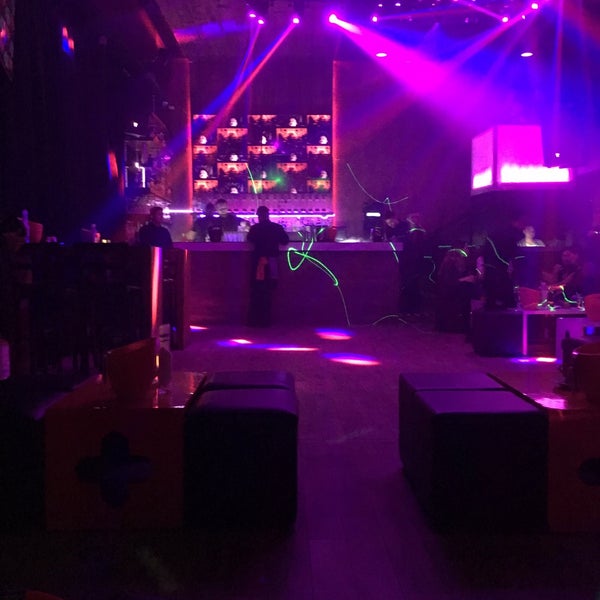
This screenshot has width=600, height=600. I want to click on table, so click(x=525, y=314).